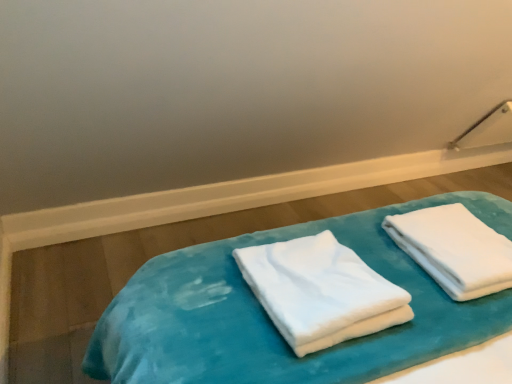
Question: Is white soft towel at center, which is the second towel in right-to-left order, in front of or behind white soft towel at right, placed as the 2th towel when sorted from left to right, in the image?

Choices:
 (A) behind
 (B) front

Answer: (B)

Question: Looking at their shapes, would you say white soft towel at center, the first towel when ordered from left to right, is wider or thinner than white soft towel at right, placed as the 2th towel when sorted from left to right?

Choices:
 (A) thin
 (B) wide

Answer: (B)

Question: Estimate the real-world distances between objects in this image. Which object is closer to the white soft towel at right, acting as the 1th towel starting from the right?

Choices:
 (A) velvet blue bed at center
 (B) white soft towel at center, which is the second towel in right-to-left order

Answer: (A)

Question: Which is nearer to the velvet blue bed at center?

Choices:
 (A) white soft towel at right, placed as the 2th towel when sorted from left to right
 (B) white soft towel at center, the first towel when ordered from left to right

Answer: (B)